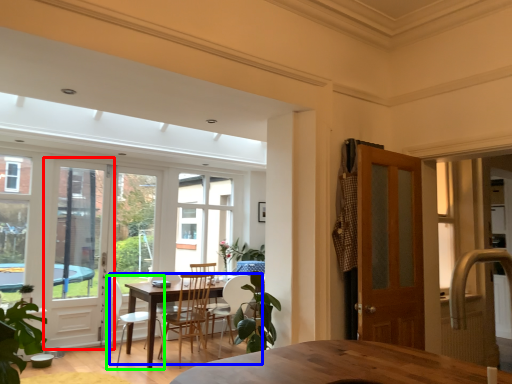
Question: Considering the real-world distances, which object is farthest from screen door (highlighted by a red box)? kitchen & dining room table (highlighted by a blue box) or chair (highlighted by a green box)?

Choices:
 (A) kitchen & dining room table
 (B) chair

Answer: (A)